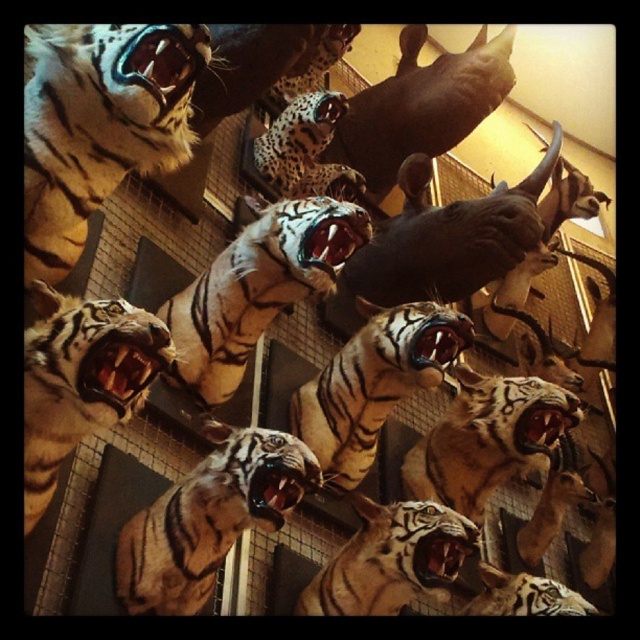
You are an art curator planning to hang a new painting in the same room as the taxidermied animal heads display. The painting is 1 meter wide and needs to be placed to the right of the point marked at coordinates (209, 516). Will there be enough space to the right of the point for the painting?

The point at coordinates (209, 516) marks the shiny golden tiger at center. Since the painting needs to be placed to the right of this point, we need to check the available space. However, the description does not provide information about the wall space or other objects to the right of the point. Therefore, it is uncertain if there is enough space for the painting.

You are an interior designer planning to add a new painting to the wall where the shiny golden tiger at center and the shiny orange tiger at center are displayed. The painting is 5 feet wide. Can you place the painting between them without overlapping either tiger?

The distance between the shiny golden tiger at center and the shiny orange tiger at center is 24.61 feet. Since the painting is only 5 feet wide, there is sufficient space to place it between them without overlapping either tiger.

Based on the photo, you are an interior designer assessing the wall display of taxidermied animal heads. You notice two tigers, the shiny golden tiger at center and the shiny orange tiger at center. Which tiger is placed higher on the wall?

The shiny orange tiger at center is placed higher on the wall because the shiny golden tiger at center is positioned under it.